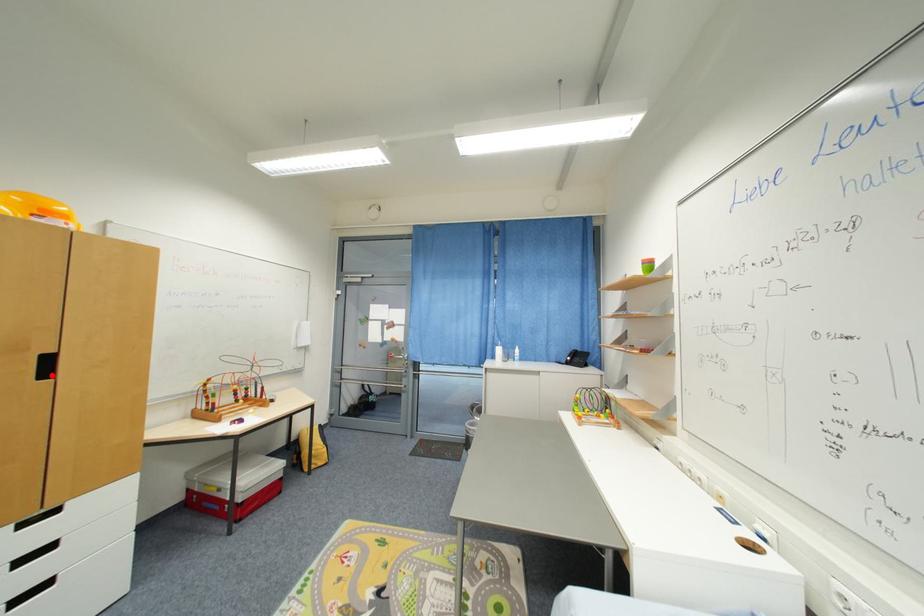
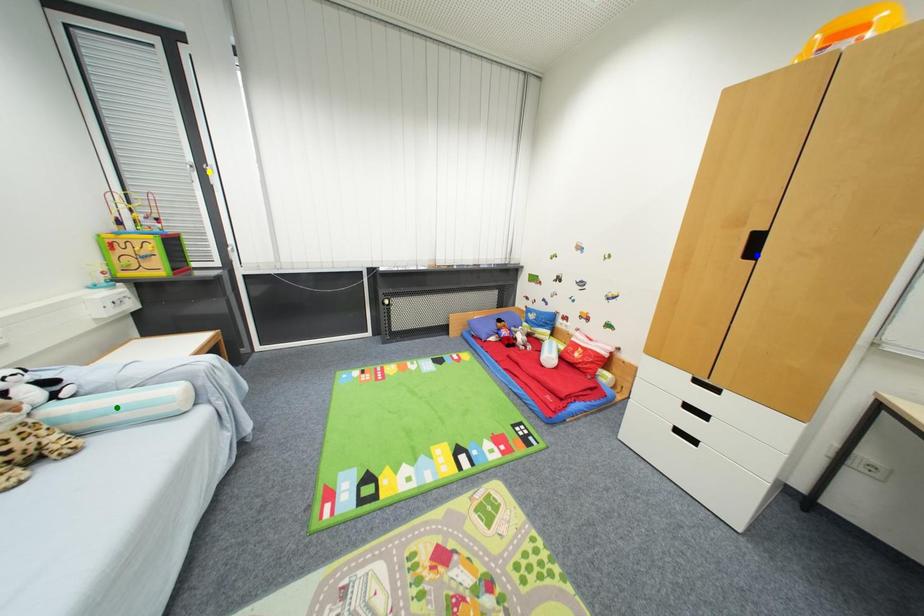
Question: I am providing you with two images of the same scene from different viewpoints. A red point is marked on the first image. You are given multiple points on the second image. Which point in image 2 is actually the same real-world point as the red point in image 1?

Choices:
 (A) green point
 (B) yellow point
 (C) blue point

Answer: (C)